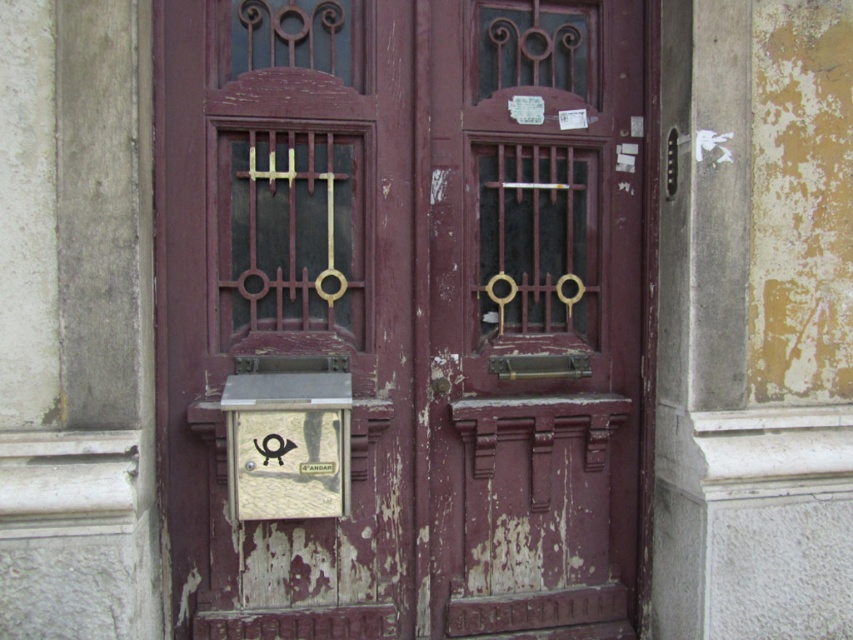
Between rusty wood door at center and rusty metal door at center, which one is positioned lower?

Positioned lower is rusty metal door at center.

Is point (387, 115) positioned behind point (549, 132)?

No, (387, 115) is closer to viewer.

This screenshot has width=853, height=640. I want to click on rusty wood door at center, so click(409, 308).

Which is more to the right, rusty metal door at center or gold textured plaque at center?

From the viewer's perspective, rusty metal door at center appears more on the right side.

Is point (637, 481) more distant than point (251, 448)?

Yes, it is behind point (251, 448).

This screenshot has width=853, height=640. What do you see at coordinates (538, 316) in the screenshot?
I see `rusty metal door at center` at bounding box center [538, 316].

Locate an element on the screen. rusty metal door at center is located at coordinates (538, 316).

Is rusty wood door at center shorter than gold textured plaque at center?

Incorrect, rusty wood door at center's height does not fall short of gold textured plaque at center's.

Locate an element on the screen. The width and height of the screenshot is (853, 640). rusty wood door at center is located at coordinates (409, 308).

You are a GUI agent. You are given a task and a screenshot of the screen. Output one action in this format:
    pyautogui.click(x=<x>, y=<y>)
    Task: Click on the rusty wood door at center
    This screenshot has width=853, height=640.
    Given the screenshot: What is the action you would take?
    pyautogui.click(x=409, y=308)